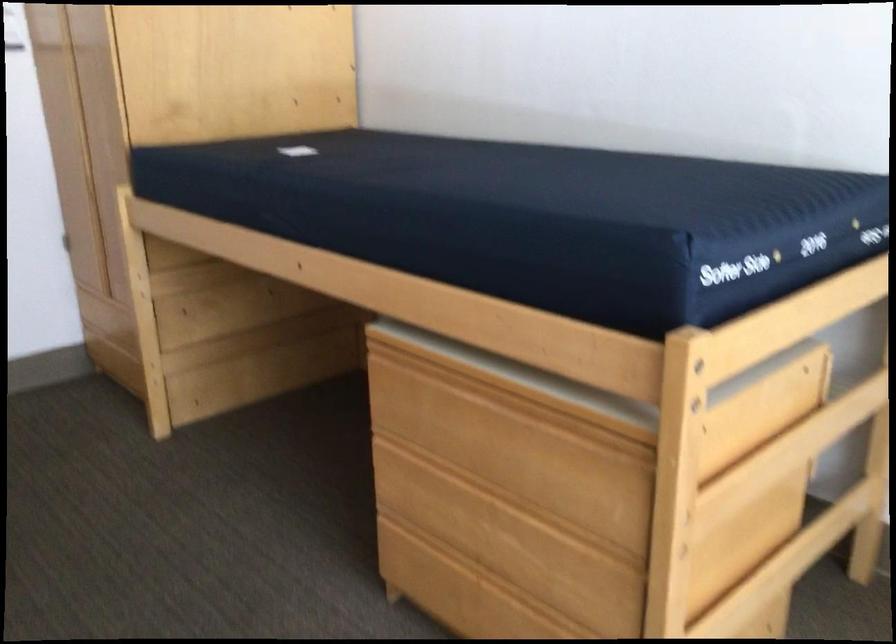
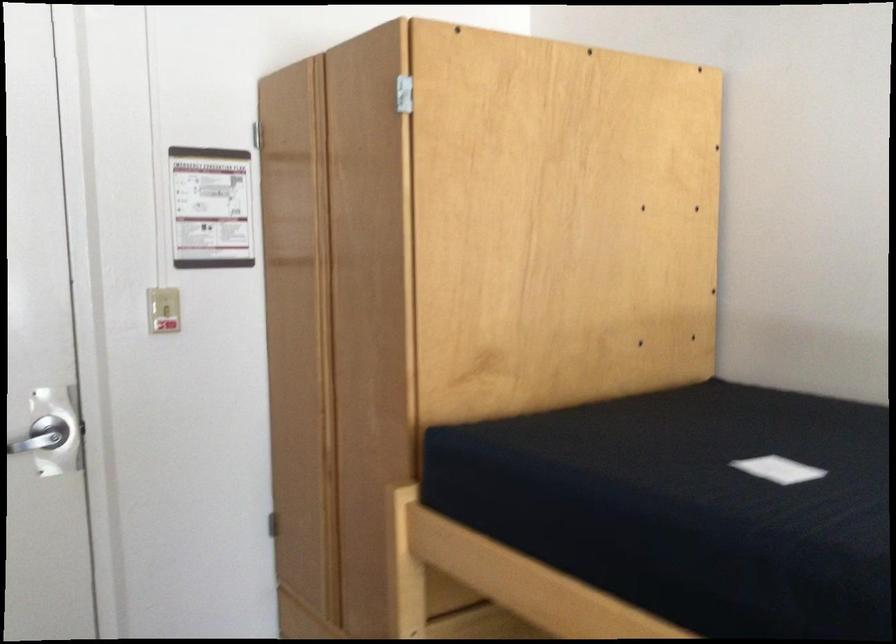
In a continuous first-person perspective shot, in which direction is the camera moving?

The cameraman moved toward left, forward.